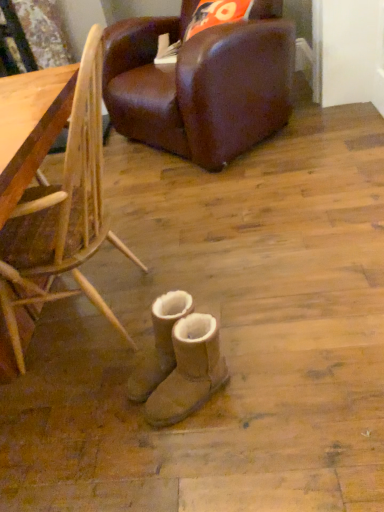
I want to click on vacant space situated above tan suede boots at center, the 2th footwear positioned from the front (from a real-world perspective), so click(169, 303).